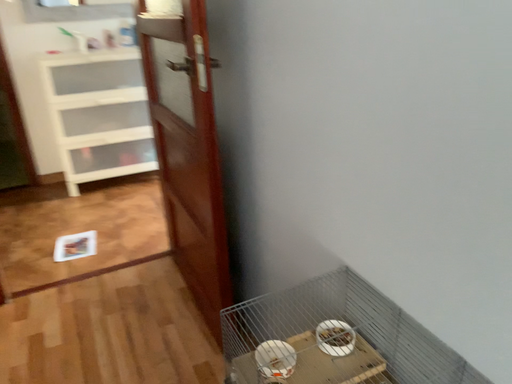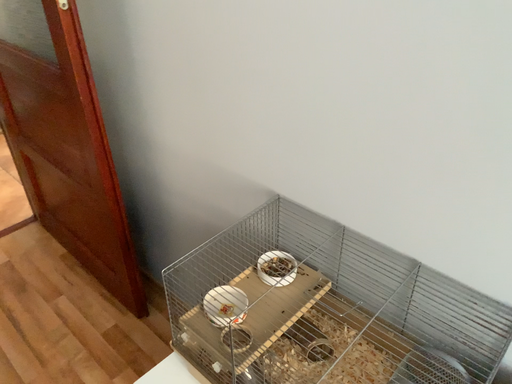
Question: How did the camera likely rotate when shooting the video?

Choices:
 (A) rotated right
 (B) rotated left

Answer: (A)